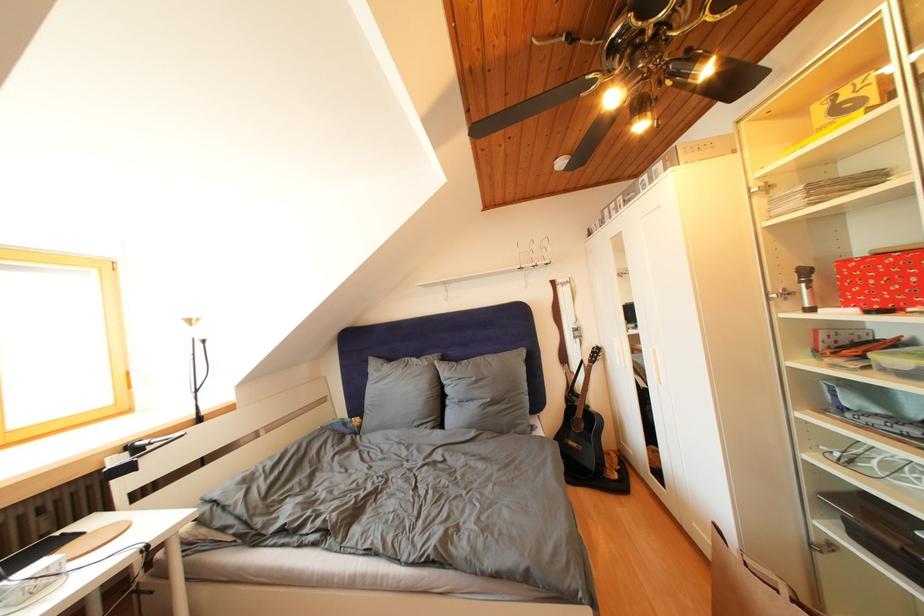
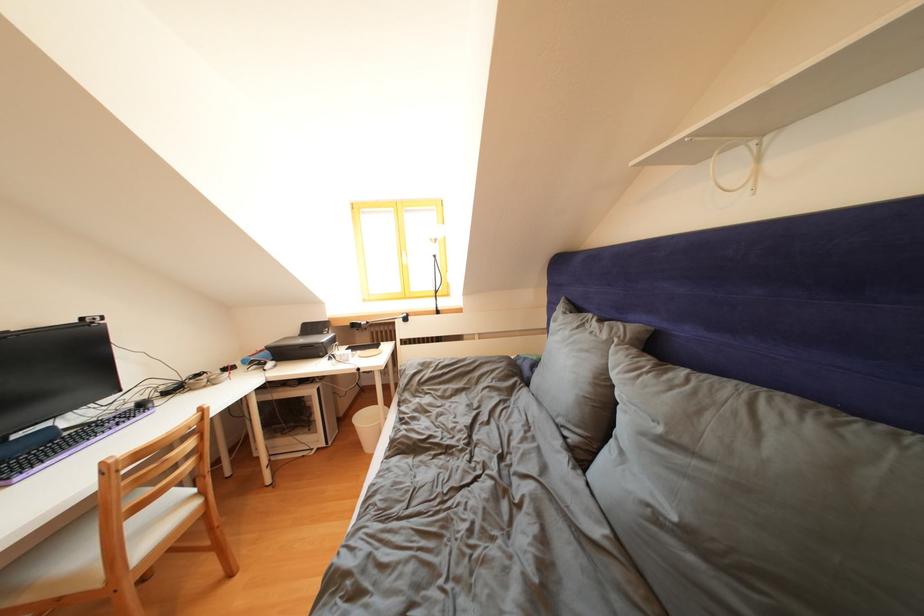
The point at (433, 369) is marked in the first image. Where is the corresponding point in the second image?

(612, 341)